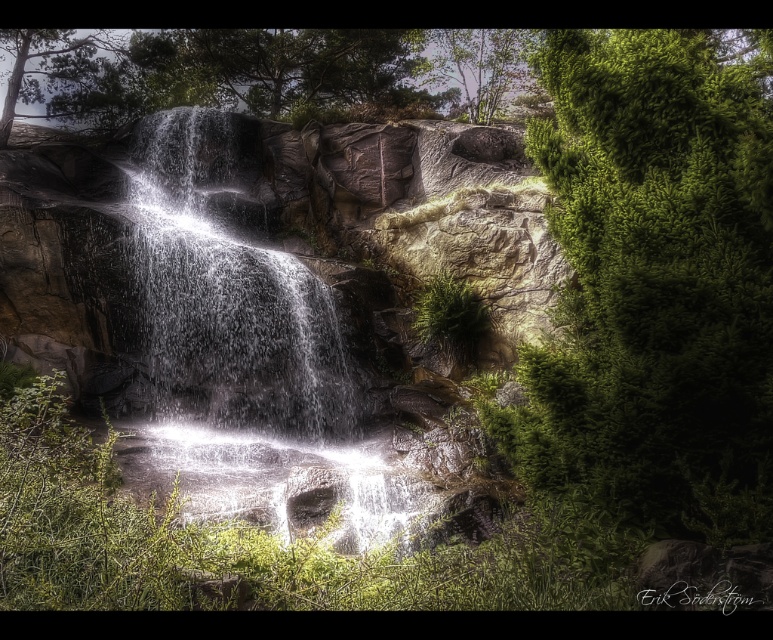
Question: Is green textured bush at right to the left of green leafy tree at upper center from the viewer's perspective?

Choices:
 (A) no
 (B) yes

Answer: (B)

Question: Estimate the real-world distances between objects in this image. Which object is closer to the green textured bush at right?

Choices:
 (A) green leafy tree at upper center
 (B) green matte tree at upper left
 (C) clear water at center

Answer: (C)

Question: Does clear water at center have a greater width compared to green leafy tree at upper center?

Choices:
 (A) yes
 (B) no

Answer: (B)

Question: Among these points, which one is nearest to the camera?

Choices:
 (A) (492, 115)
 (B) (104, 51)
 (C) (162, 403)

Answer: (C)

Question: Estimate the real-world distances between objects in this image. Which object is farther from the green textured bush at right?

Choices:
 (A) clear water at center
 (B) green leafy tree at upper center

Answer: (B)

Question: Is green matte tree at upper left closer to the viewer compared to green leafy tree at upper center?

Choices:
 (A) yes
 (B) no

Answer: (A)